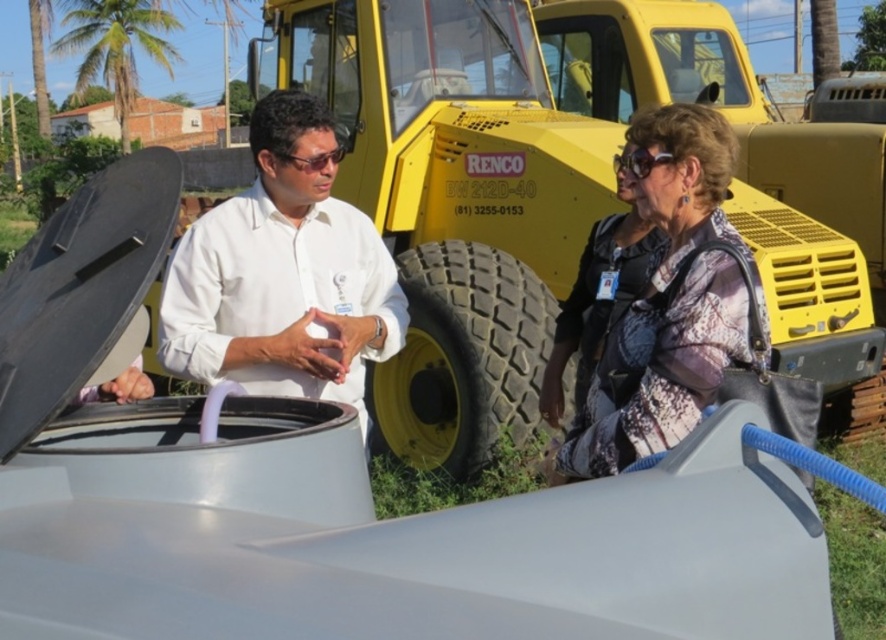
You are a photographer taking a picture of the scene. You want to ensure both the patterned fabric dress at center and the black rubber tire at center are clearly visible. Which object should you focus on first to ensure both are in focus?

The patterned fabric dress at center is located above the black rubber tire at center, so focusing on the dress first will ensure both are in focus as the tire is below it.

You are a photographer trying to capture a candid shot of the two people in the scene. Since you want to ensure the focus is on their faces, you need to know which person is wider to adjust your camera settings accordingly. Which person has a wider torso? The white matte shirt at center or the patterned fabric dress at center?

The white matte shirt at center has a greater width than the patterned fabric dress at center, so you should adjust your camera settings to focus on the white matte shirt at center as it is wider.

What are the coordinates of the patterned fabric dress at center?

The patterned fabric dress at center is located at point (669, 305).